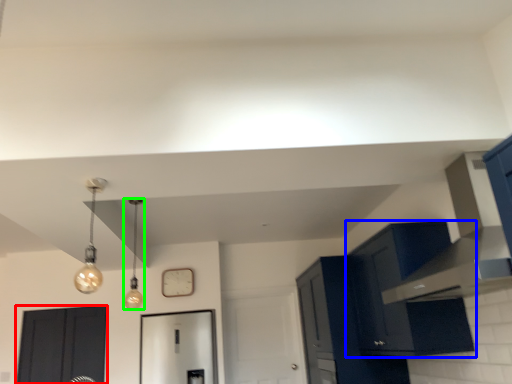
Question: Which object is positioned farthest from door (highlighted by a red box)? Select from cabinetry (highlighted by a blue box) and light fixture (highlighted by a green box).

Choices:
 (A) cabinetry
 (B) light fixture

Answer: (A)